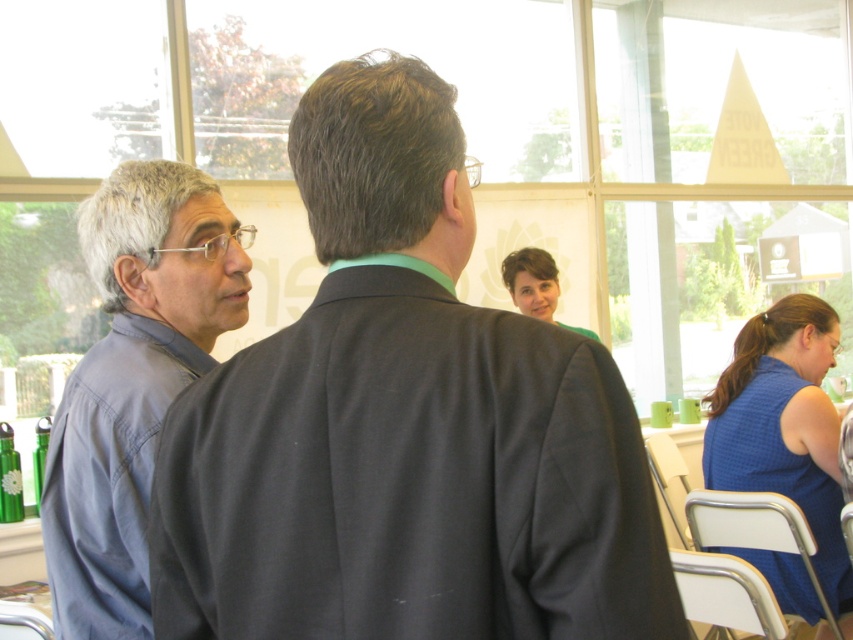
This screenshot has width=853, height=640. What do you see at coordinates (784, 426) in the screenshot? I see `blue textured dress at lower right` at bounding box center [784, 426].

Does blue textured dress at lower right come in front of matte green shirt at center?

Yes, it is in front of matte green shirt at center.

The image size is (853, 640). Describe the element at coordinates (784, 426) in the screenshot. I see `blue textured dress at lower right` at that location.

Image resolution: width=853 pixels, height=640 pixels. What are the coordinates of `blue textured dress at lower right` in the screenshot? It's located at (784, 426).

Is blue cotton shirt at left above blue textured dress at lower right?

Yes.

Who is shorter, blue cotton shirt at left or blue textured dress at lower right?

With less height is blue cotton shirt at left.

Locate an element on the screen. The height and width of the screenshot is (640, 853). blue cotton shirt at left is located at coordinates click(132, 381).

Identify the location of blue cotton shirt at left. The height and width of the screenshot is (640, 853). (132, 381).

Who is more forward, (579,600) or (142,349)?

Point (579,600) is more forward.

Measure the distance between matte gray shirt at left and camera.

matte gray shirt at left is 32.39 inches away from camera.

Which is behind, point (300, 461) or point (97, 570)?

Point (97, 570)

Where is `matte gray shirt at left`? The width and height of the screenshot is (853, 640). matte gray shirt at left is located at coordinates (403, 426).